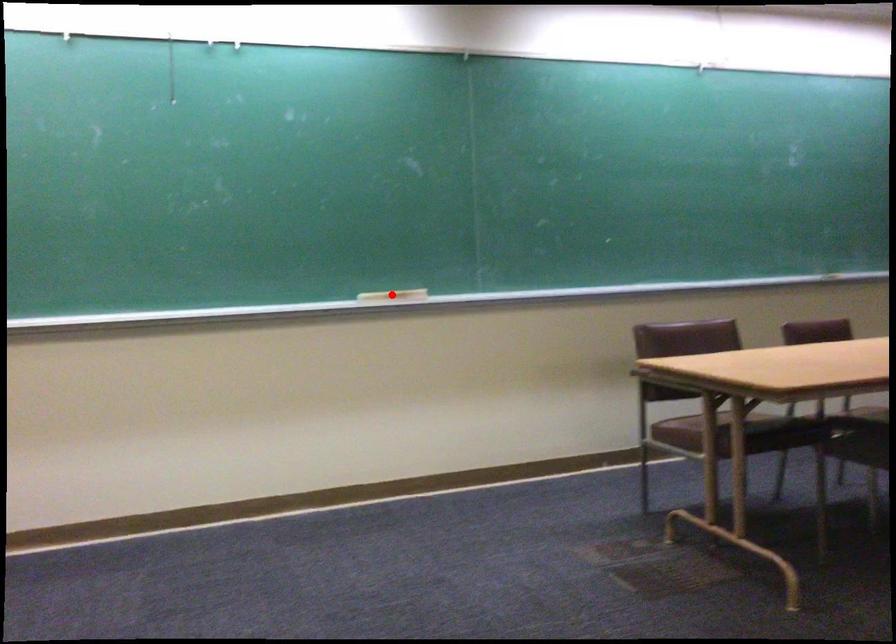
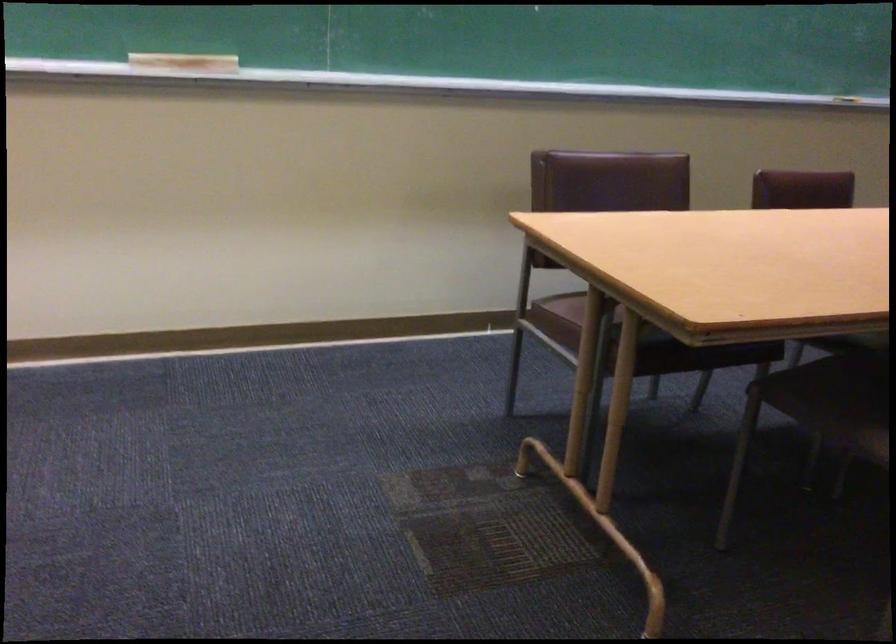
Find the pixel in the second image that matches the highlighted location in the first image.

(183, 64)